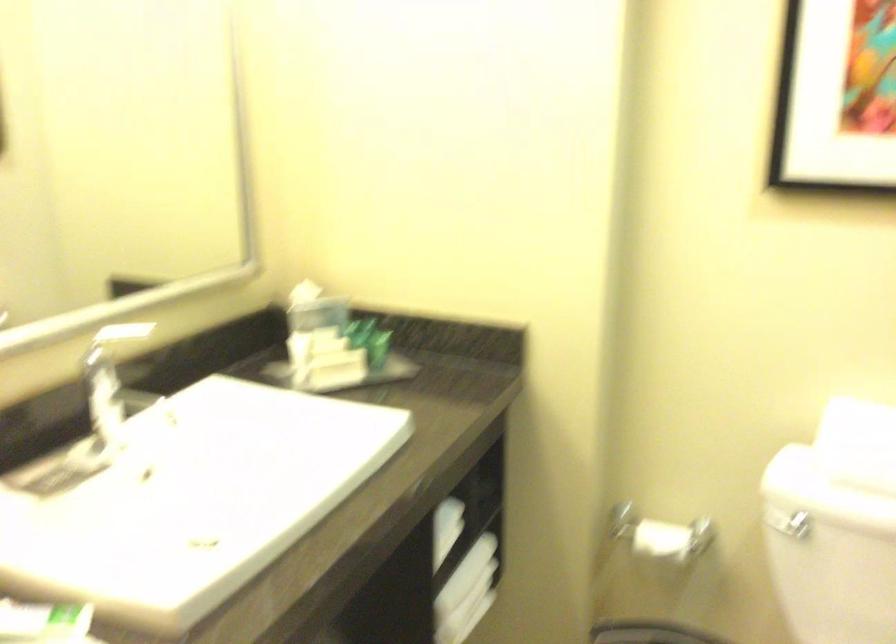
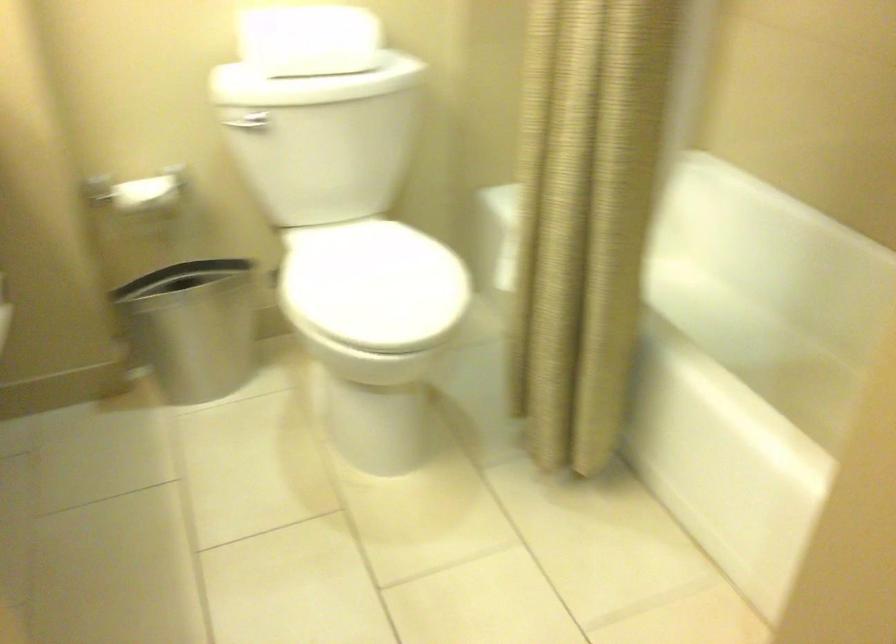
Locate, in the second image, the point that corresponds to pixel 788 520 in the first image.

(247, 122)